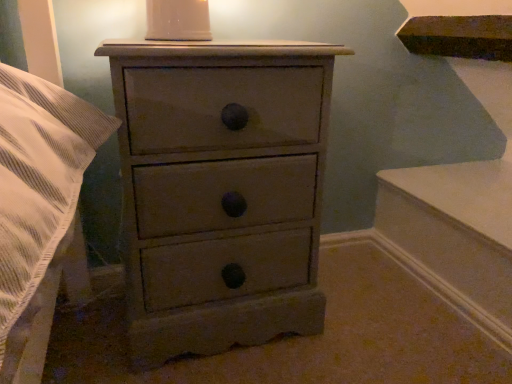
At what (x,y) coordinates should I click in order to perform the action: click on matte gray chest of drawers at center. Please return your answer as a coordinate pair (x, y). Looking at the image, I should click on tap(220, 190).

What do you see at coordinates (220, 190) in the screenshot?
I see `matte gray chest of drawers at center` at bounding box center [220, 190].

You are a GUI agent. You are given a task and a screenshot of the screen. Output one action in this format:
    pyautogui.click(x=<x>, y=<y>)
    Task: Click on the white glossy candle holder at upper center
    
    Given the screenshot: What is the action you would take?
    pyautogui.click(x=178, y=20)

What do you see at coordinates (178, 20) in the screenshot? Image resolution: width=512 pixels, height=384 pixels. I see `white glossy candle holder at upper center` at bounding box center [178, 20].

The height and width of the screenshot is (384, 512). What are the coordinates of `matte gray chest of drawers at center` in the screenshot? It's located at pos(220,190).

Is matte gray chest of drawers at center at the left side of white glossy candle holder at upper center?

No, matte gray chest of drawers at center is not to the left of white glossy candle holder at upper center.

Is matte gray chest of drawers at center in front of or behind white glossy candle holder at upper center in the image?

In the image, matte gray chest of drawers at center appears in front of white glossy candle holder at upper center.

Does point (293, 47) come in front of point (170, 40)?

Yes, point (293, 47) is in front of point (170, 40).

From the image's perspective, is matte gray chest of drawers at center located above or below white glossy candle holder at upper center?

Based on their image positions, matte gray chest of drawers at center is located beneath white glossy candle holder at upper center.

Consider the image. From a real-world perspective, is matte gray chest of drawers at center on top of white glossy candle holder at upper center?

No.

Does matte gray chest of drawers at center have a greater width compared to white glossy candle holder at upper center?

Yes, matte gray chest of drawers at center is wider than white glossy candle holder at upper center.

From their relative heights in the image, would you say matte gray chest of drawers at center is taller or shorter than white glossy candle holder at upper center?

matte gray chest of drawers at center is taller than white glossy candle holder at upper center.

Considering the sizes of objects matte gray chest of drawers at center and white glossy candle holder at upper center in the image provided, who is smaller, matte gray chest of drawers at center or white glossy candle holder at upper center?

With smaller size is white glossy candle holder at upper center.

Is matte gray chest of drawers at center inside the boundaries of white glossy candle holder at upper center, or outside?

matte gray chest of drawers at center is not inside white glossy candle holder at upper center, it's outside.

Are matte gray chest of drawers at center and white glossy candle holder at upper center far apart?

matte gray chest of drawers at center is actually quite close to white glossy candle holder at upper center.

Could you tell me if matte gray chest of drawers at center is facing white glossy candle holder at upper center?

No, matte gray chest of drawers at center is not turned towards white glossy candle holder at upper center.

How far apart are matte gray chest of drawers at center and white glossy candle holder at upper center?

They are 36.66 centimeters apart.

Image resolution: width=512 pixels, height=384 pixels. Find the location of `candle holder that is behind the matte gray chest of drawers at center`. candle holder that is behind the matte gray chest of drawers at center is located at coordinates (178, 20).

Considering the positions of objects white glossy candle holder at upper center and matte gray chest of drawers at center in the image provided, who is more to the right, white glossy candle holder at upper center or matte gray chest of drawers at center?

matte gray chest of drawers at center is more to the right.

Which is behind, white glossy candle holder at upper center or matte gray chest of drawers at center?

white glossy candle holder at upper center.

Is point (156, 15) closer or farther from the camera than point (213, 208)?

Clearly, point (156, 15) is more distant from the camera than point (213, 208).

From the image's perspective, which one is positioned lower, white glossy candle holder at upper center or matte gray chest of drawers at center?

matte gray chest of drawers at center.

From a real-world perspective, is white glossy candle holder at upper center above or below matte gray chest of drawers at center?

In terms of real-world spatial position, white glossy candle holder at upper center is above matte gray chest of drawers at center.

Considering the relative sizes of white glossy candle holder at upper center and matte gray chest of drawers at center in the image provided, is white glossy candle holder at upper center thinner than matte gray chest of drawers at center?

Yes.

Is white glossy candle holder at upper center shorter than matte gray chest of drawers at center?

Indeed, white glossy candle holder at upper center has a lesser height compared to matte gray chest of drawers at center.

Is white glossy candle holder at upper center smaller than matte gray chest of drawers at center?

Yes, white glossy candle holder at upper center is smaller than matte gray chest of drawers at center.

Is matte gray chest of drawers at center completely or partially inside white glossy candle holder at upper center?

No, matte gray chest of drawers at center is located outside of white glossy candle holder at upper center.

Looking at this image, is the surface of white glossy candle holder at upper center in direct contact with matte gray chest of drawers at center?

Result: They are not placed beside each other.

Is matte gray chest of drawers at center at the back of white glossy candle holder at upper center?

No, white glossy candle holder at upper center is not facing the opposite direction of matte gray chest of drawers at center.

How many degrees apart are the facing directions of white glossy candle holder at upper center and matte gray chest of drawers at center?

white glossy candle holder at upper center and matte gray chest of drawers at center are facing 3.81 degrees away from each other.

Measure the distance from white glossy candle holder at upper center to matte gray chest of drawers at center.

The distance of white glossy candle holder at upper center from matte gray chest of drawers at center is 36.66 centimeters.

I want to click on chest of drawers below the white glossy candle holder at upper center (from a real-world perspective), so click(x=220, y=190).

Locate an element on the screen. The width and height of the screenshot is (512, 384). chest of drawers below the white glossy candle holder at upper center (from a real-world perspective) is located at coordinates pyautogui.click(x=220, y=190).

At what (x,y) coordinates should I click in order to perform the action: click on the chest of drawers located below the white glossy candle holder at upper center (from the image's perspective). Please return your answer as a coordinate pair (x, y). Looking at the image, I should click on (220, 190).